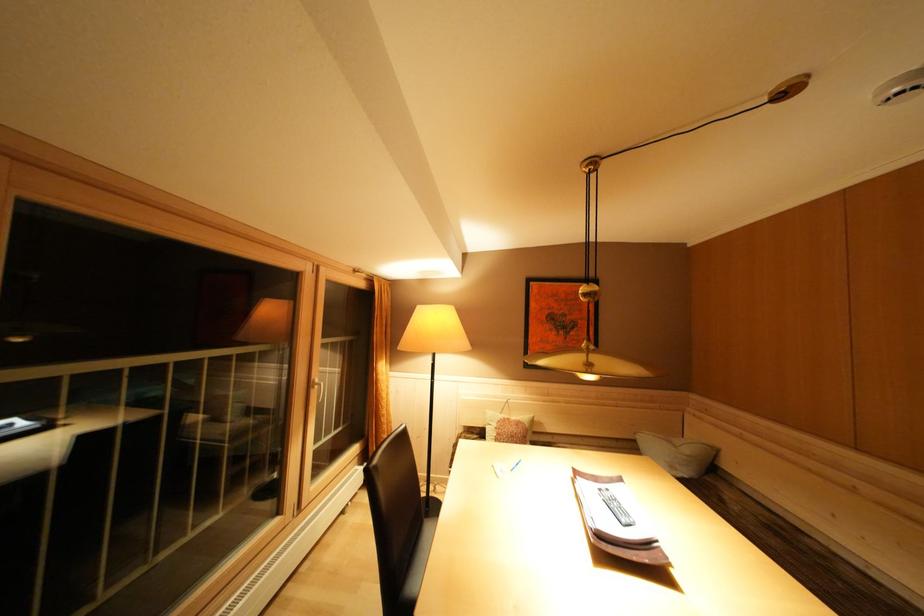
Image resolution: width=924 pixels, height=616 pixels. What do you see at coordinates (318, 389) in the screenshot?
I see `a light pulley handle` at bounding box center [318, 389].